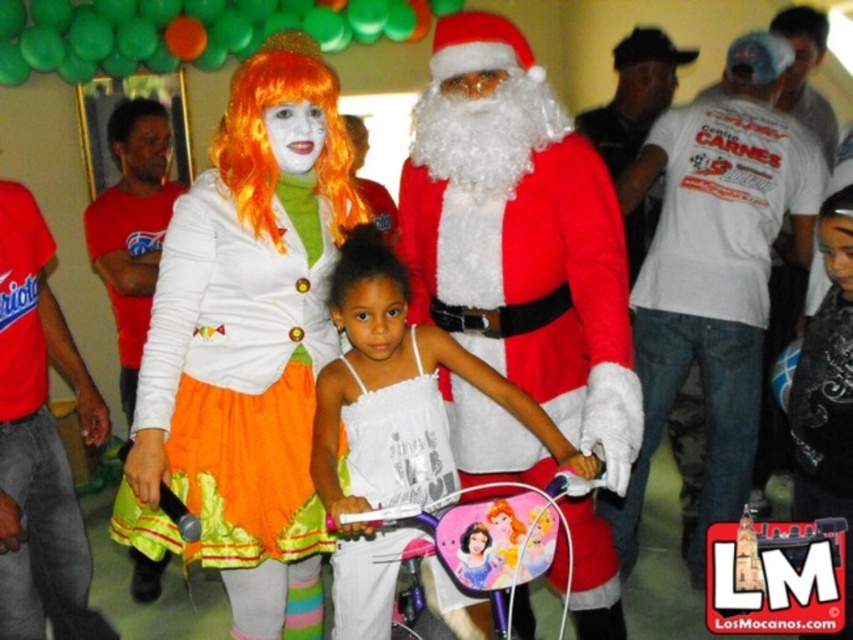
Based on the photo, based on the coordinates provided, which object is located at point (519, 236) in the scene?

The point (519, 236) marks the location of the velvet red santa suit at center.

In the festive indoor scene, there are two red garments visible. One is the velvet red santa suit at center and the other is the matte red shirt at left. Which of these garments is bigger in size?

The velvet red santa suit at center is larger in size than the matte red shirt at left.